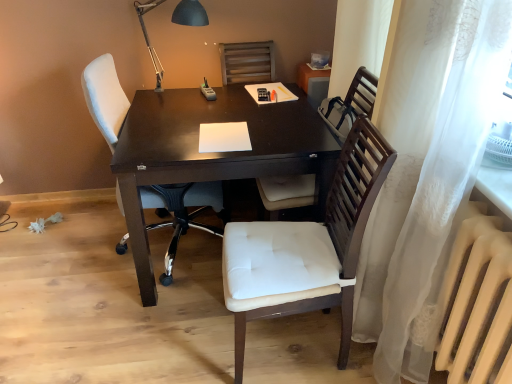
I want to click on vacant area that lies between black metal table lamp at upper center and white paper at center, so click(192, 120).